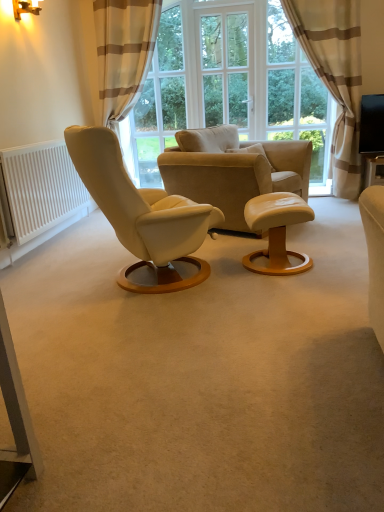
Find the location of a particular element. free region under white matte radiator at left (from a real-world perspective) is located at coordinates (53, 242).